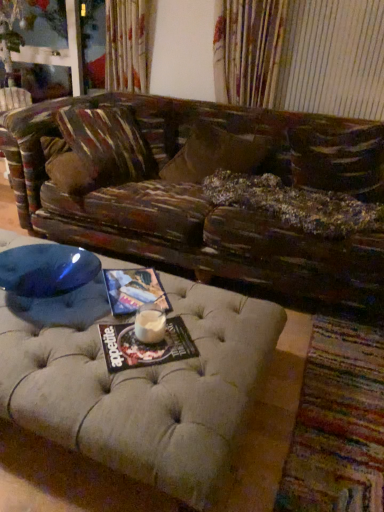
Find the location of a particular element. This screenshot has height=512, width=384. unoccupied region to the right of white frothy liquid at center is located at coordinates (187, 337).